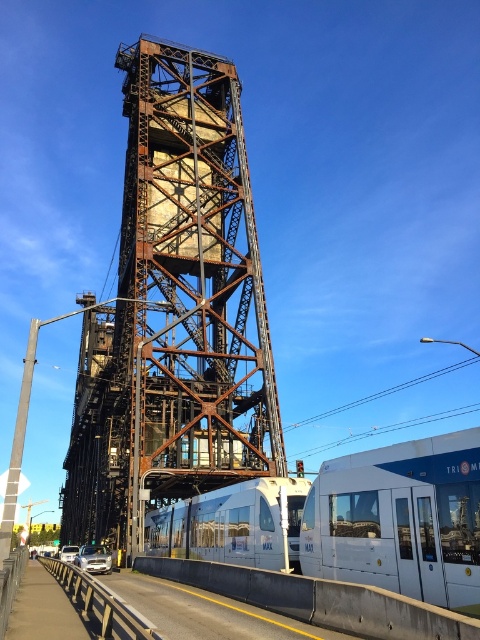
Locate an element on the screen. The width and height of the screenshot is (480, 640). white glossy train at lower right is located at coordinates 399,518.

Measure the distance from white glossy train at lower right to white glossy passenger train at lower center.

They are 10.78 meters apart.

Is point (398, 492) positioned after point (278, 532)?

No, (398, 492) is in front of (278, 532).

Image resolution: width=480 pixels, height=640 pixels. What are the coordinates of `white glossy train at lower right` in the screenshot? It's located at (399, 518).

Is point (229, 177) behind point (348, 493)?

Yes, it is.

Which of these two, rusty metal tower at center or white glossy train at lower right, stands taller?

rusty metal tower at center

Locate an element on the screen. The image size is (480, 640). rusty metal tower at center is located at coordinates (175, 310).

Looking at this image, can you confirm if rusty metal tower at center is bigger than white glossy passenger train at lower center?

Indeed, rusty metal tower at center has a larger size compared to white glossy passenger train at lower center.

Can you confirm if rusty metal tower at center is positioned to the left of white glossy passenger train at lower center?

Indeed, rusty metal tower at center is positioned on the left side of white glossy passenger train at lower center.

The image size is (480, 640). I want to click on rusty metal tower at center, so click(x=175, y=310).